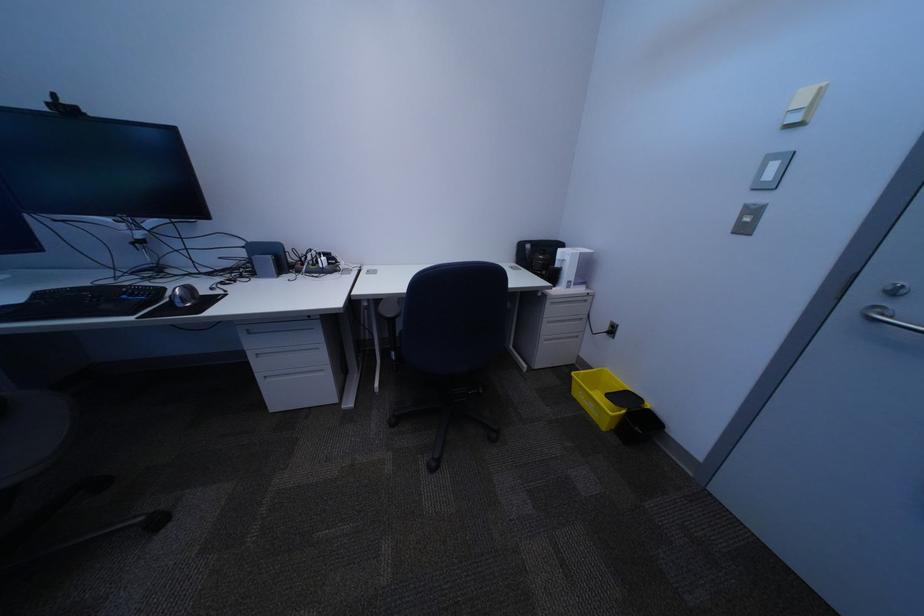
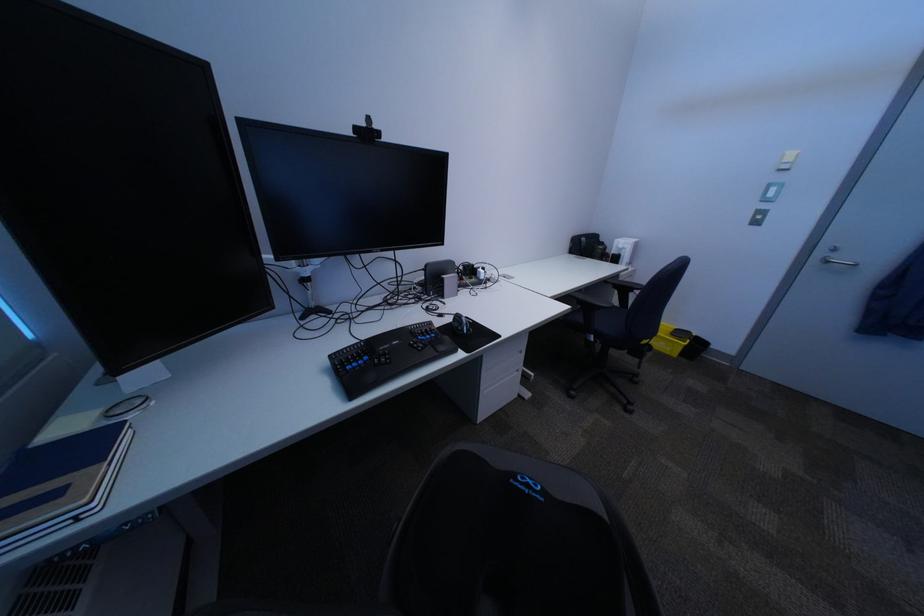
Find the pixel in the second image that matches [821,107] in the first image.

(807, 163)